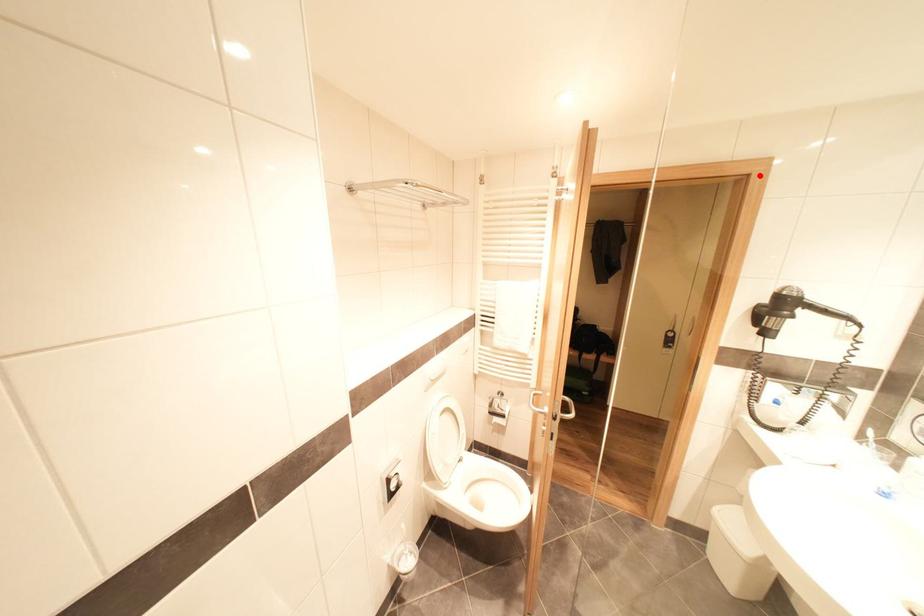
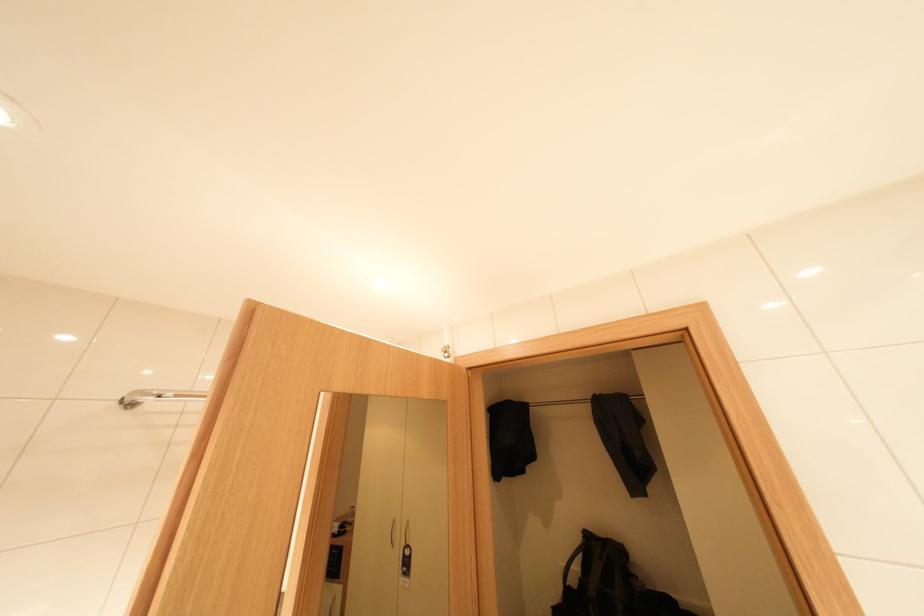
Where in the second image is the point corresponding to the highlighted location from the first image?

(697, 330)